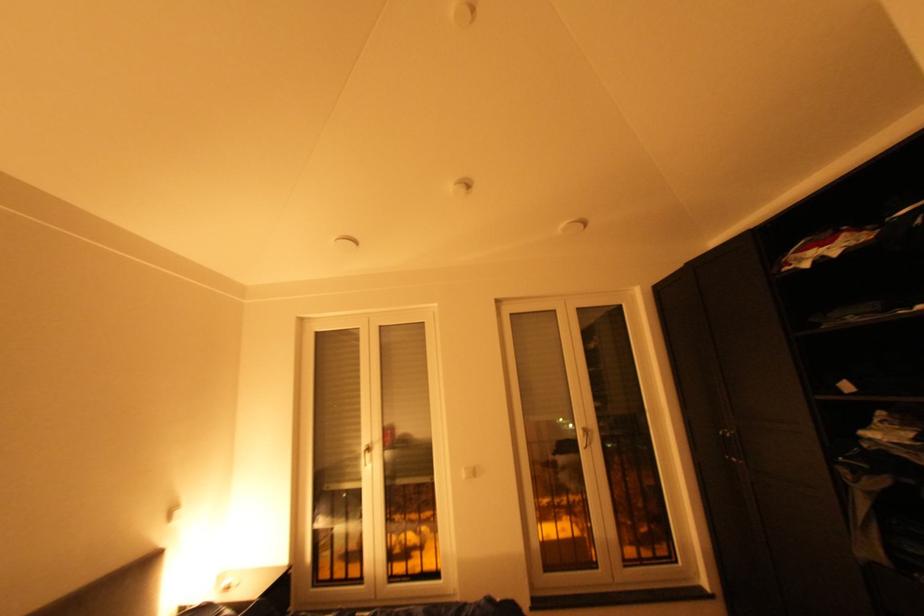
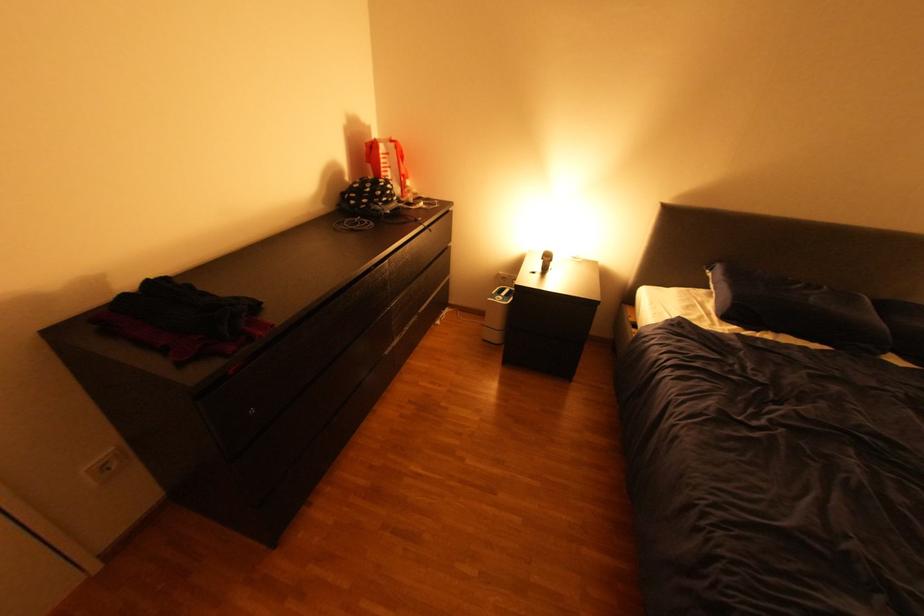
First-person continuous shooting, in which direction is the camera rotating?

The camera's rotation is toward left-down.